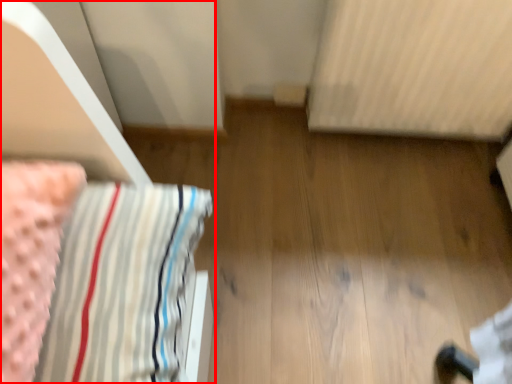
Question: From the image's perspective, what is the correct spatial positioning of furniture (annotated by the red box) in reference to radiator?

Choices:
 (A) below
 (B) above

Answer: (A)